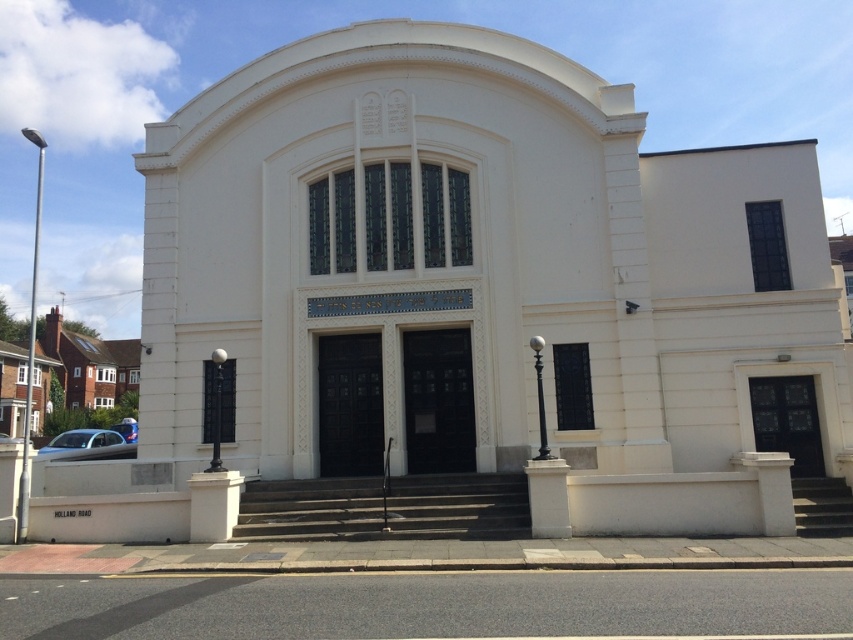
You are a delivery driver approaching the synagogue. Your metallic silver car at lower left is parked 75.83 feet away from the dark gray concrete stairs at center leading to the entrance. If you need to unload packages within 50 feet of the stairs, will you need to move your car?

The metallic silver car at lower left is 75.83 feet away from the dark gray concrete stairs at center, which is beyond the 50 feet requirement. Therefore, you will need to move your car closer to unload the packages within the required distance.